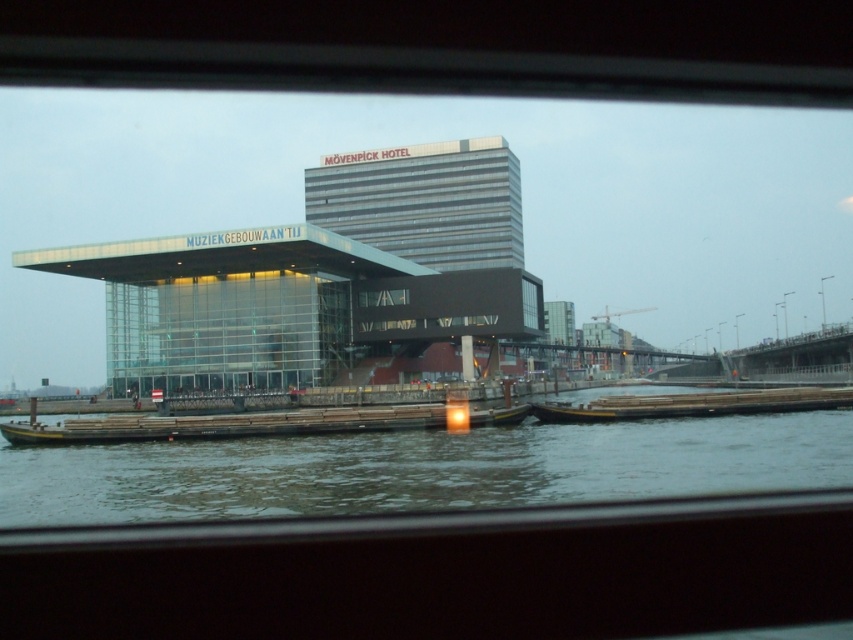
Question: Which point is closer to the camera?

Choices:
 (A) wooden planks at lower center
 (B) greenish water at lower center

Answer: (B)

Question: Which object appears farthest from the camera in this image?

Choices:
 (A) greenish water at lower center
 (B) wooden planks at lower center

Answer: (B)

Question: Which point appears closest to the camera in this image?

Choices:
 (A) (218, 474)
 (B) (703, 404)

Answer: (A)

Question: Is greenish water at lower center in front of wooden planks at lower center?

Choices:
 (A) no
 (B) yes

Answer: (B)

Question: Can you confirm if greenish water at lower center is positioned above wooden planks at lower center?

Choices:
 (A) yes
 (B) no

Answer: (A)

Question: Can you confirm if greenish water at lower center is positioned to the right of wooden planks at lower center?

Choices:
 (A) no
 (B) yes

Answer: (A)